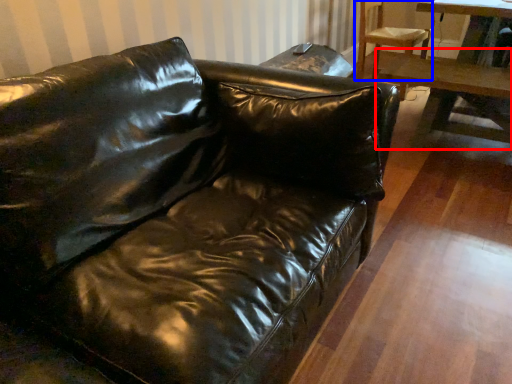
Question: Which object is further to the camera taking this photo, table (highlighted by a red box) or chair (highlighted by a blue box)?

Choices:
 (A) table
 (B) chair

Answer: (B)